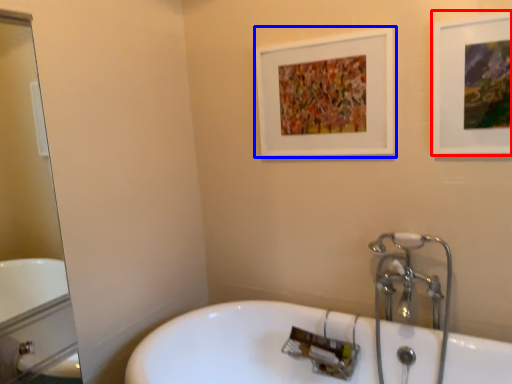
Question: Among these objects, which one is farthest to the camera, picture frame (highlighted by a red box) or picture frame (highlighted by a blue box)?

Choices:
 (A) picture frame
 (B) picture frame

Answer: (B)